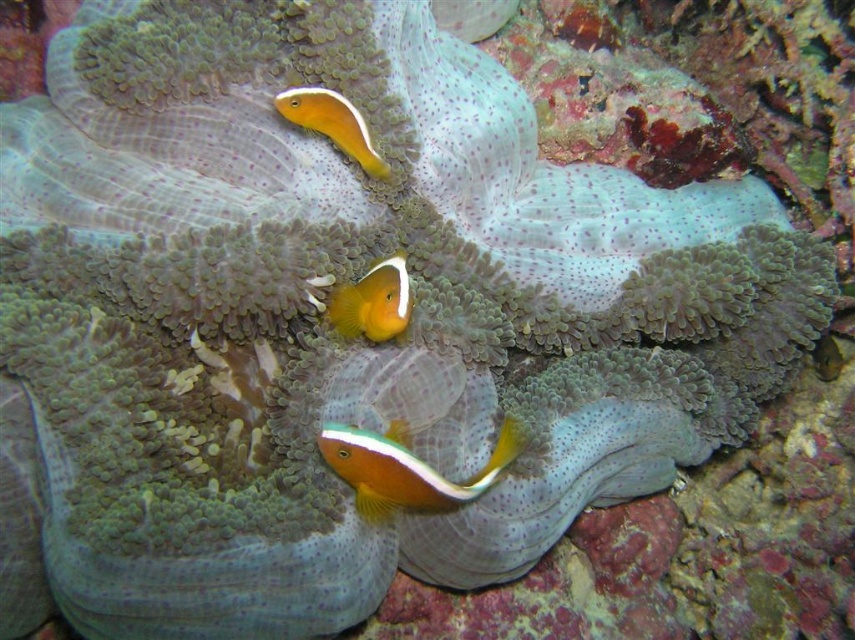
Is point (416, 502) farther from viewer compared to point (397, 292)?

That is True.

Is orange matte fish at center below orange matte clownfish at center?

Indeed, orange matte fish at center is positioned under orange matte clownfish at center.

The height and width of the screenshot is (640, 855). In order to click on orange matte fish at center in this screenshot , I will do `click(405, 468)`.

This screenshot has height=640, width=855. Identify the location of orange matte fish at center. (405, 468).

Does point (343, 310) lie in front of point (357, 136)?

Yes, point (343, 310) is closer to viewer.

Can you confirm if orange matte clownfish at center is thinner than orange glossy clownfish at upper center?

Correct, orange matte clownfish at center's width is less than orange glossy clownfish at upper center's.

What do you see at coordinates (373, 301) in the screenshot? I see `orange matte clownfish at center` at bounding box center [373, 301].

Locate an element on the screen. The width and height of the screenshot is (855, 640). orange matte clownfish at center is located at coordinates (373, 301).

Which is behind, point (386, 451) or point (335, 144)?

The point (335, 144) is more distant.

Identify the location of orange matte fish at center. Image resolution: width=855 pixels, height=640 pixels. (405, 468).